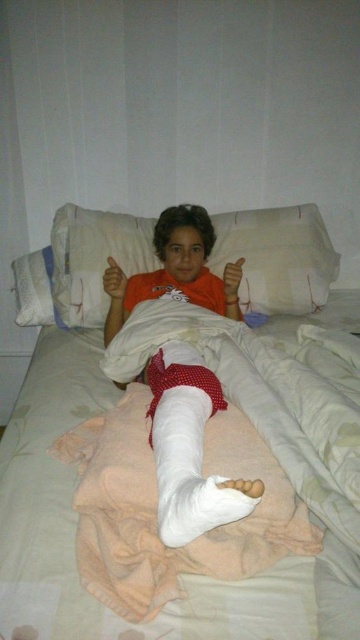
Can you confirm if white soft bed at center is positioned above white matte plaster bandage at lower center?

Actually, white soft bed at center is below white matte plaster bandage at lower center.

This screenshot has width=360, height=640. What do you see at coordinates (276, 424) in the screenshot?
I see `white soft bed at center` at bounding box center [276, 424].

Which is behind, point (335, 387) or point (209, 400)?

Positioned behind is point (335, 387).

Locate an element on the screen. white soft bed at center is located at coordinates (276, 424).

Who is positioned more to the right, white soft bed at center or matte orange hand at center?

Positioned to the right is white soft bed at center.

Consider the image. Which is below, white soft bed at center or matte orange hand at center?

white soft bed at center is lower down.

Who is more forward, (326,621) or (114,275)?

Point (326,621) is more forward.

This screenshot has width=360, height=640. Identify the location of white soft bed at center. (276, 424).

Can you confirm if white bandage at center is positioned to the right of orange matte hand at center?

Incorrect, white bandage at center is not on the right side of orange matte hand at center.

Image resolution: width=360 pixels, height=640 pixels. What do you see at coordinates (189, 448) in the screenshot?
I see `white bandage at center` at bounding box center [189, 448].

You are a GUI agent. You are given a task and a screenshot of the screen. Output one action in this format:
    pyautogui.click(x=<x>, y=<y>)
    Task: Click on the white bandage at center
    This screenshot has width=360, height=640.
    Given the screenshot: What is the action you would take?
    pyautogui.click(x=189, y=448)